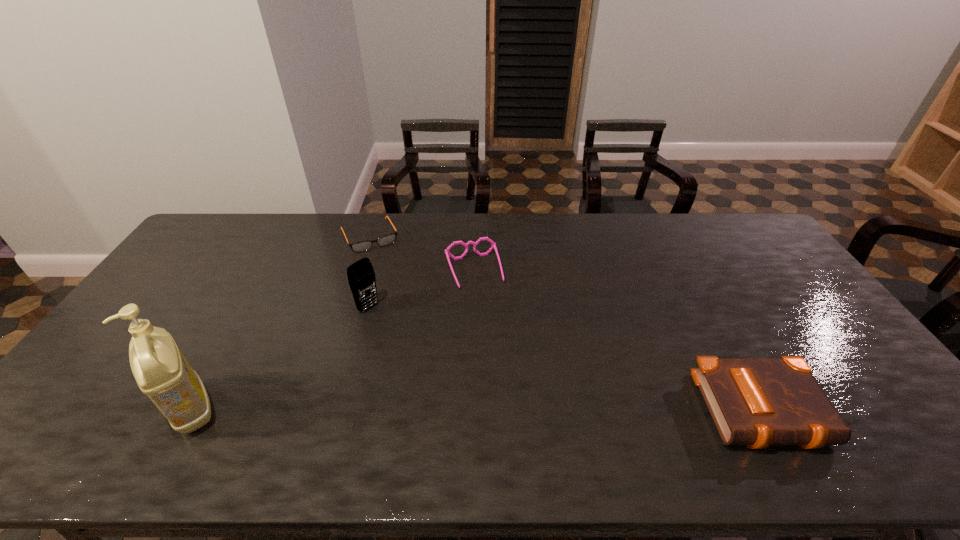
Where is `the tallest object`? This screenshot has width=960, height=540. the tallest object is located at coordinates (161, 371).

Find the location of `the leftmost object`. the leftmost object is located at coordinates (161, 371).

The width and height of the screenshot is (960, 540). I want to click on Bible, so click(x=755, y=402).

You are a GUI agent. You are given a task and a screenshot of the screen. Output one action in this format:
    pyautogui.click(x=<x>, y=<y>)
    Task: Click on the right spectacles
    The width and height of the screenshot is (960, 540).
    Given the screenshot: What is the action you would take?
    pyautogui.click(x=493, y=245)

Where is `the taller spectacles`? The image size is (960, 540). the taller spectacles is located at coordinates (493, 245).

Identify the location of the left spectacles. This screenshot has height=540, width=960. (361, 246).

Identify the location of the shortest object. (361, 246).

Identify the location of cellular telephone. The image size is (960, 540). (361, 276).

I want to click on the third farthest object, so click(361, 276).

I want to click on vacant region located on the back of the detergent, so click(240, 321).